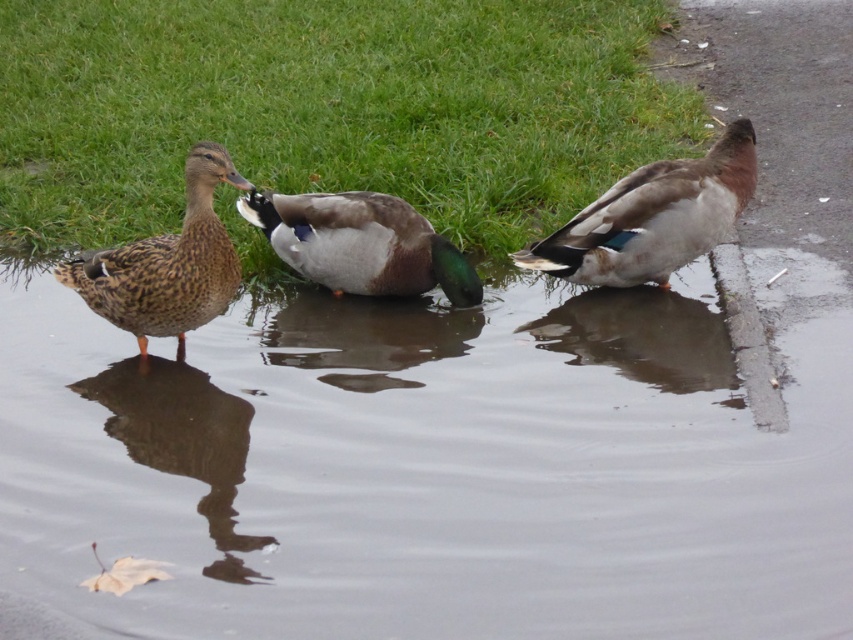
You are standing on the paved path and want to observe the brown speckled duck at left and the smooth concrete curb at right. Based on their positions, which object is closer to the water surface?

The brown speckled duck at left is located above the smooth concrete curb at right, meaning it is closer to the water surface than the curb.

You are a photographer aiming to capture the reflection of the transparent water at center and the smooth concrete curb at right in your shot. Which object should you position closer to the camera to ensure its reflection is more prominent in the photo?

To make the reflection of the transparent water at center more prominent, position yourself closer to it since it is located to the left of the smooth concrete curb at right, making it nearer to the camera viewpoint.